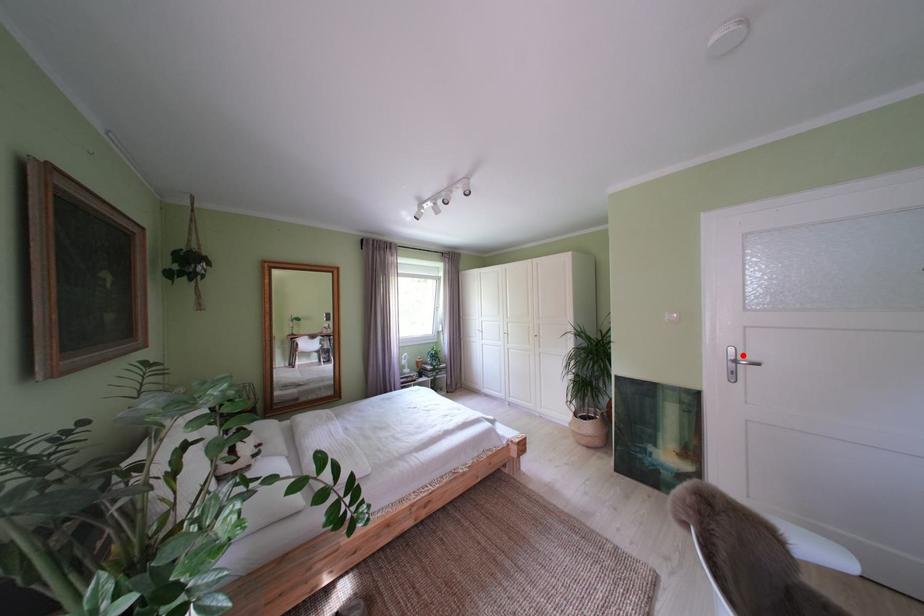
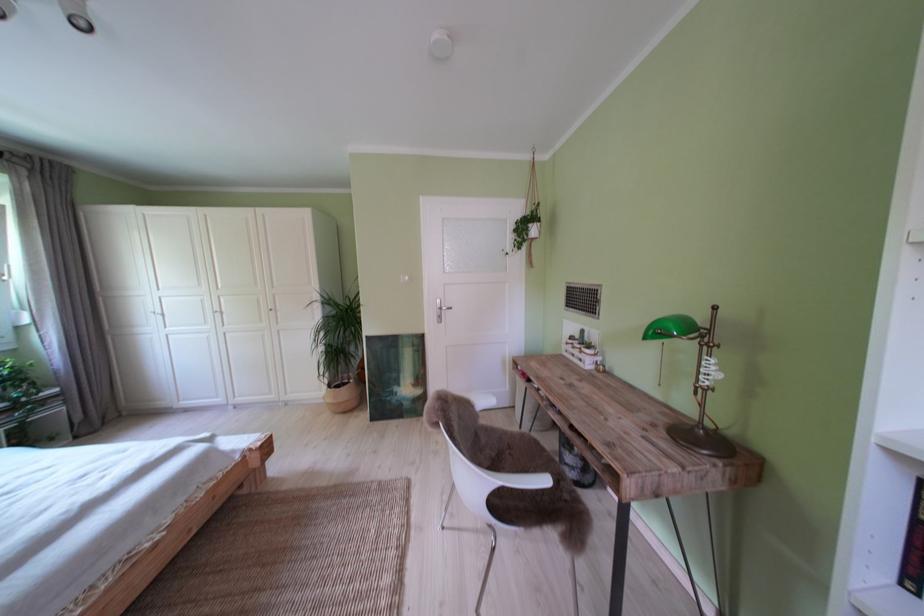
Where in the second image is the point corresponding to the highlighted location from the first image?

(450, 307)